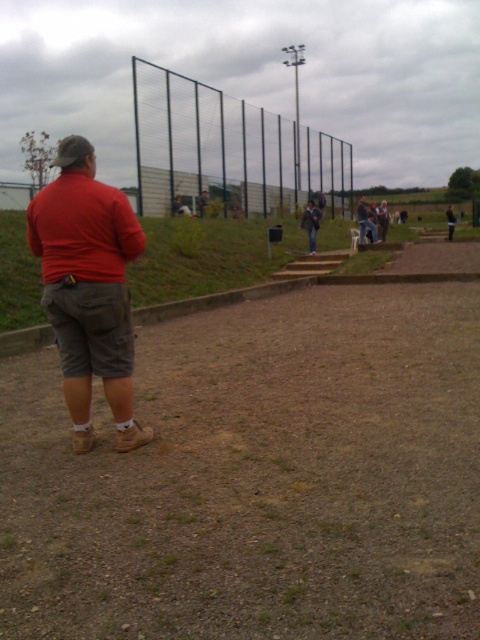
You are standing at the point with coordinates point [314,212] and want to walk towards the point with coordinates point [50,228]. Which direction should you move in?

Point [50,228] is closer to the viewer than point [314,212]. Therefore, you should move forward towards the direction of the closer point.

You are a fashion designer observing the outdoor scene. You notice two jackets in the crowd. Which jacket is smaller in size between the dark gray fabric jacket at center and the light brown leather jacket at upper center?

The dark gray fabric jacket at center is smaller than the light brown leather jacket at upper center.